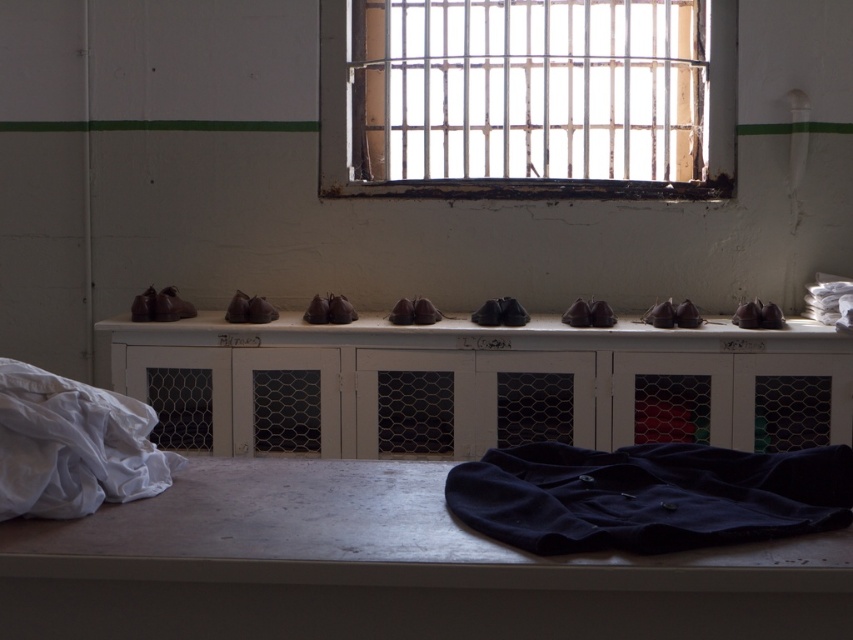
You are standing in the room and notice two points marked on the wall. The first point is at coordinates point (521, 192) and the second is at point (192, 509). If you were to walk towards the wall, which point would you encounter first?

Point (192, 509) would be encountered first because it is closer to you than point (521, 192), which is further away.

You are an inmate in this facility and need to place a small item on a surface. Which object, the metallic bars at upper center or the metallic gray ledge at lower center, is a suitable surface for placing the item?

The metallic gray ledge at lower center is a suitable surface for placing the item because it is located below the metallic bars at upper center and is likely a flat horizontal surface, whereas the bars are vertical and part of the window structure.

You are an orderly tasked with organizing the communal area. You notice the velvet dark blue shirt at center and the white cotton cloth at lower left. Which item should you place on a higher shelf to ensure proper storage based on their sizes?

The velvet dark blue shirt at center is shorter than the white cotton cloth at lower left, so you should place the white cotton cloth at lower left on a higher shelf to accommodate its larger size.